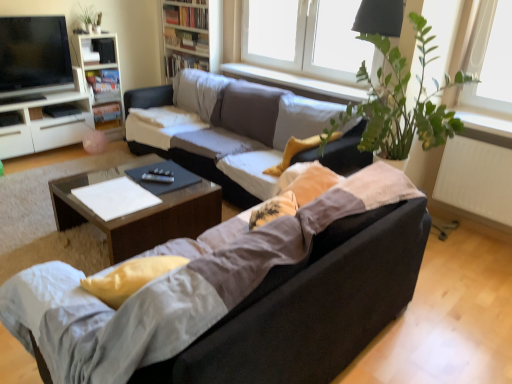
Question: Is matte black tv at upper left at the right side of wooden bookshelf at upper center, which is the first bookshelf from right to left?

Choices:
 (A) yes
 (B) no

Answer: (B)

Question: Considering the relative sizes of matte black tv at upper left and wooden bookshelf at upper center, which is counted as the 2th bookshelf, starting from the left, in the image provided, is matte black tv at upper left smaller than wooden bookshelf at upper center, which is counted as the 2th bookshelf, starting from the left,?

Choices:
 (A) yes
 (B) no

Answer: (A)

Question: Does matte black tv at upper left come in front of wooden bookshelf at upper center, which is counted as the 2th bookshelf, starting from the left?

Choices:
 (A) yes
 (B) no

Answer: (A)

Question: From the image's perspective, is matte black tv at upper left on wooden bookshelf at upper center, which is counted as the 2th bookshelf, starting from the left?

Choices:
 (A) yes
 (B) no

Answer: (B)

Question: Is matte black tv at upper left behind wooden bookshelf at upper center, which is counted as the 2th bookshelf, starting from the left?

Choices:
 (A) yes
 (B) no

Answer: (B)

Question: Is matte black tv at upper left not close to wooden bookshelf at upper center, which is counted as the 2th bookshelf, starting from the left?

Choices:
 (A) no
 (B) yes

Answer: (B)

Question: Is matte black tv at upper left to the left of white smooth window sill at upper center from the viewer's perspective?

Choices:
 (A) yes
 (B) no

Answer: (A)

Question: Are matte black tv at upper left and white smooth window sill at upper center far apart?

Choices:
 (A) no
 (B) yes

Answer: (B)

Question: From the image's perspective, is matte black tv at upper left under white smooth window sill at upper center?

Choices:
 (A) no
 (B) yes

Answer: (A)

Question: Can you confirm if matte black tv at upper left is smaller than white smooth window sill at upper center?

Choices:
 (A) no
 (B) yes

Answer: (A)

Question: From a real-world perspective, does matte black tv at upper left stand above white smooth window sill at upper center?

Choices:
 (A) yes
 (B) no

Answer: (A)

Question: Does matte black tv at upper left have a greater height compared to white smooth window sill at upper center?

Choices:
 (A) yes
 (B) no

Answer: (A)

Question: Is white glossy cabinet at left to the right of white plastic window at upper center from the viewer's perspective?

Choices:
 (A) no
 (B) yes

Answer: (A)